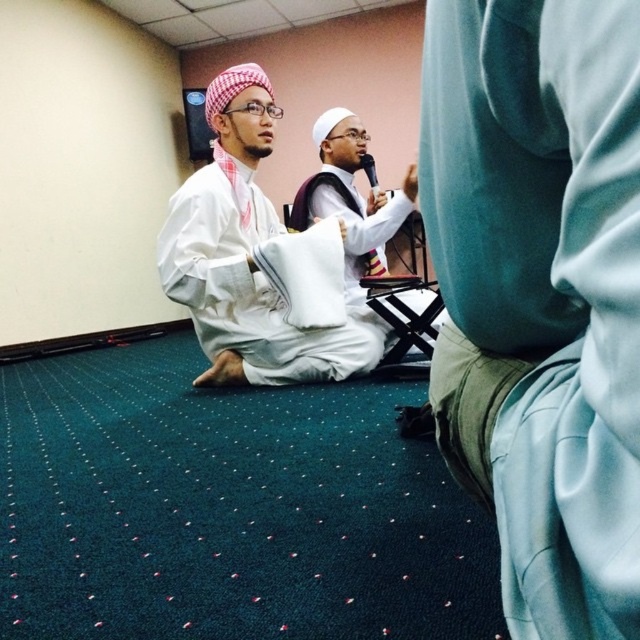
Image resolution: width=640 pixels, height=640 pixels. I want to click on light blue fabric at center, so click(540, 294).

Does point (556, 353) lie behind point (358, 232)?

No, it is not.

Find the location of a particular element. light blue fabric at center is located at coordinates (540, 294).

Does white cotton robe at center appear on the right side of white matte shirt at center?

No, white cotton robe at center is not to the right of white matte shirt at center.

Does white cotton robe at center have a greater height compared to white matte shirt at center?

Yes.

Find the location of a particular element. Image resolution: width=640 pixels, height=640 pixels. white cotton robe at center is located at coordinates (243, 256).

Identify the location of white cotton robe at center. point(243,256).

Does light blue fabric at center have a larger size compared to white cotton robe at center?

No, light blue fabric at center is not bigger than white cotton robe at center.

Is point (467, 342) closer to viewer compared to point (291, 372)?

That is True.

Where is `light blue fabric at center`? The height and width of the screenshot is (640, 640). light blue fabric at center is located at coordinates (540, 294).